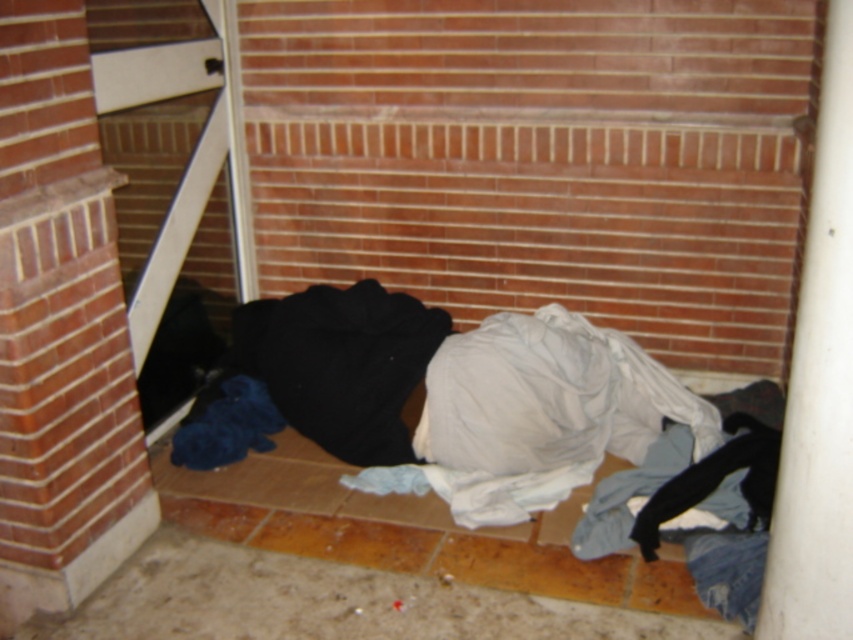
You are standing at the corner of a building with a brick wall and tiled floor. You see a pile of clothes scattered on the floor near the corner, including a white garment. There is a specific point marked at coordinates point (x=480, y=404). What item is located at that point?

The item located at point (x=480, y=404) is white cotton laundry at center.